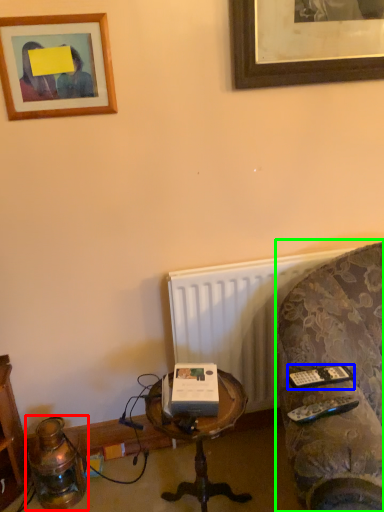
Question: Which is nearer to the table lamp (highlighted by a red box)? remote (highlighted by a blue box) or studio couch (highlighted by a green box).

Choices:
 (A) remote
 (B) studio couch

Answer: (A)